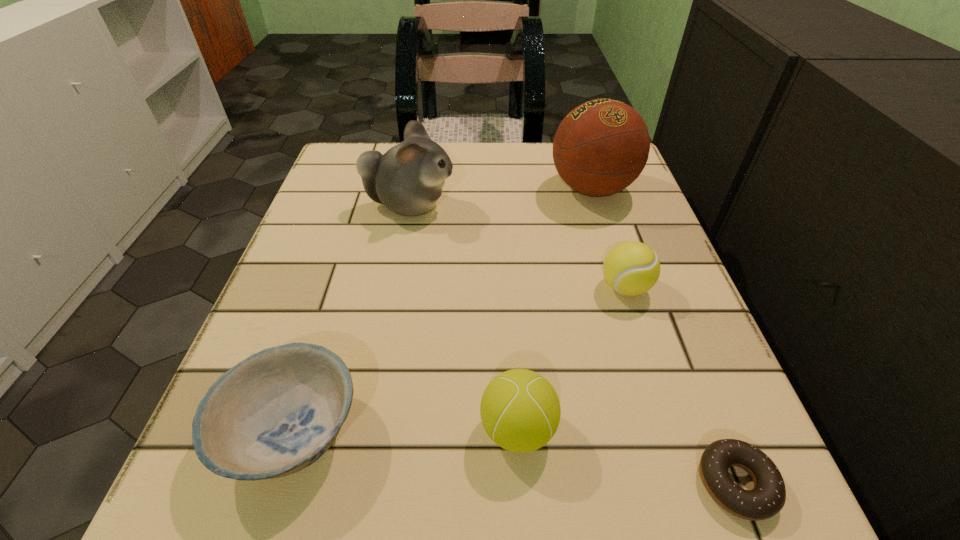
This screenshot has height=540, width=960. In order to click on free space at the left edge of the desktop in this screenshot , I will do coord(320,201).

Find the location of a particular element. free location at the right edge is located at coordinates (717, 369).

Identify the location of free space at the far right corner of the desktop. (635, 186).

This screenshot has height=540, width=960. In order to click on free region at the near right corner of the desktop in this screenshot , I will do `click(686, 531)`.

Where is `unoccupied area between the third farthest object and the doughnut`? unoccupied area between the third farthest object and the doughnut is located at coordinates (681, 385).

Where is `vacant space in between the basketball and the shortest object`? This screenshot has height=540, width=960. vacant space in between the basketball and the shortest object is located at coordinates (664, 336).

What are the coordinates of `free space between the nearer tennis ball and the basketball` in the screenshot? It's located at (555, 308).

Image resolution: width=960 pixels, height=540 pixels. What are the coordinates of `free space that is in between the farther tennis ball and the shortest object` in the screenshot? It's located at (681, 385).

The height and width of the screenshot is (540, 960). I want to click on vacant space in between the shortest object and the fourth nearest object, so click(681, 385).

Image resolution: width=960 pixels, height=540 pixels. I want to click on free space between the doughnut and the bowl, so pos(515,457).